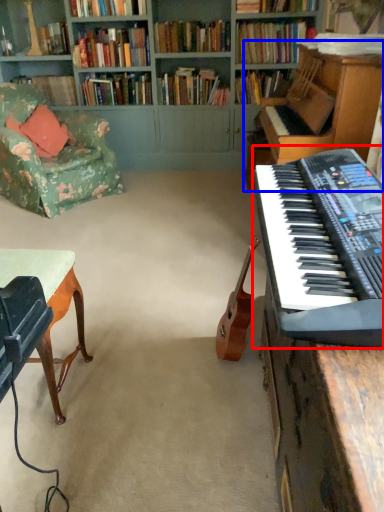
Question: Which of the following is the farthest to the observer, musical keyboard (highlighted by a red box) or piano (highlighted by a blue box)?

Choices:
 (A) musical keyboard
 (B) piano

Answer: (B)